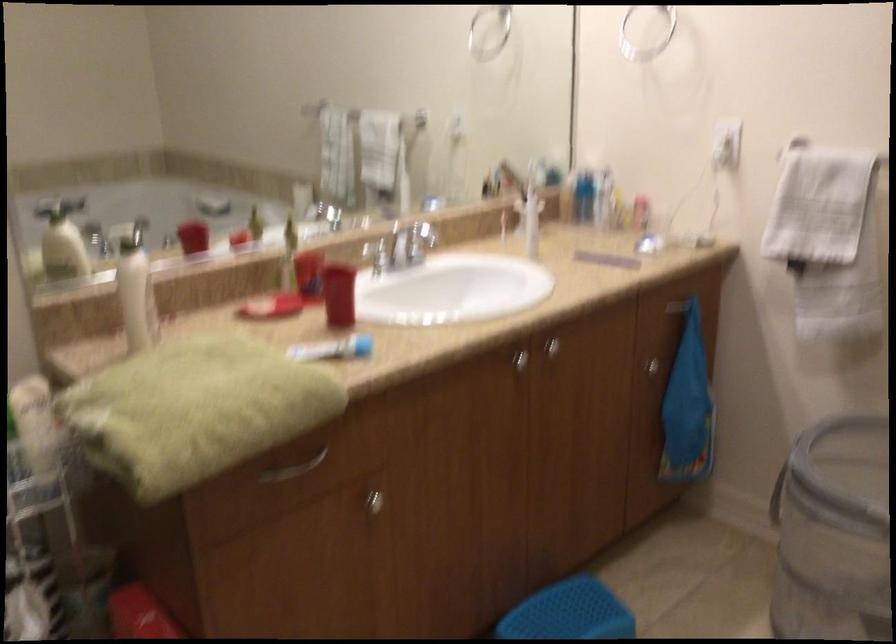
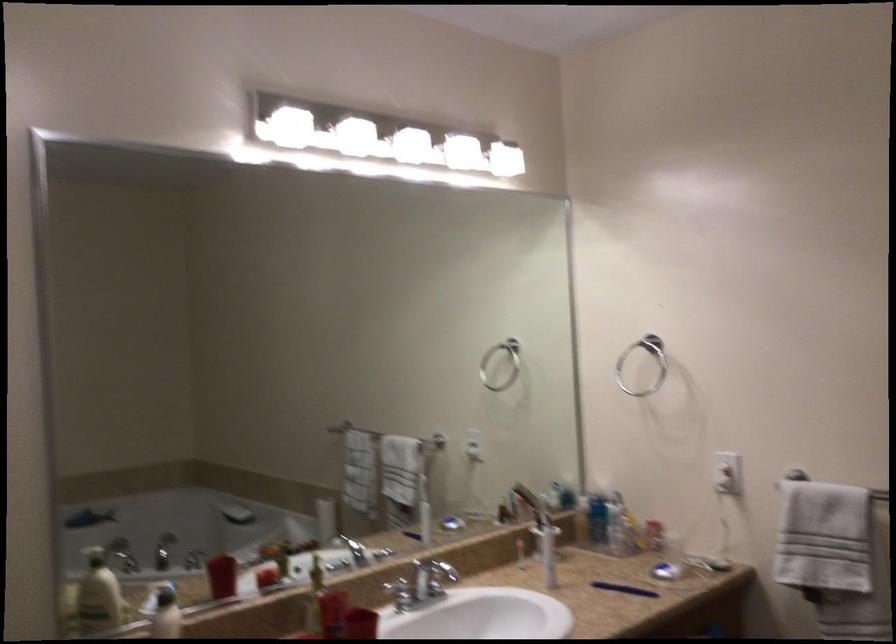
Question: In a continuous first-person perspective shot, in which direction is the camera moving?

Choices:
 (A) Left
 (B) Right
 (C) Forward
 (D) Backward

Answer: (D)